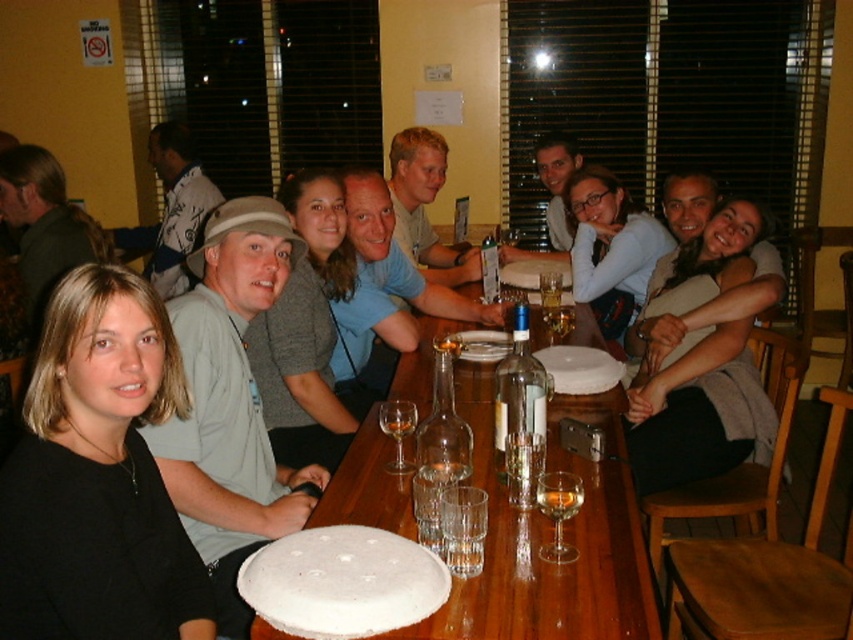
Consider the image. Is the position of wooden table at center more distant than that of clear glass wine at table center?

No, it is not.

Does wooden table at center appear on the left side of clear glass wine at table center?

In fact, wooden table at center is to the right of clear glass wine at table center.

You are a GUI agent. You are given a task and a screenshot of the screen. Output one action in this format:
    pyautogui.click(x=<x>, y=<y>)
    Task: Click on the wooden table at center
    
    Given the screenshot: What is the action you would take?
    pyautogui.click(x=549, y=540)

The image size is (853, 640). What are the coordinates of `wooden table at center` in the screenshot? It's located at (549, 540).

Which is in front, point (62, 340) or point (544, 294)?

Point (62, 340)

From the picture: Is black fabric at left above translucent glass at table center?

Actually, black fabric at left is below translucent glass at table center.

Is point (7, 524) closer to camera compared to point (556, 307)?

Yes, it is.

Image resolution: width=853 pixels, height=640 pixels. What are the coordinates of `black fabric at left` in the screenshot? It's located at (97, 476).

Is clear glass at table center shorter than clear glass wine at table center?

No.

Is clear glass at table center in front of clear glass wine at table center?

Yes, it is.

Between point (476, 540) and point (397, 438), which one is positioned in front?

Point (476, 540) is in front.

The image size is (853, 640). I want to click on clear glass at table center, so click(x=463, y=552).